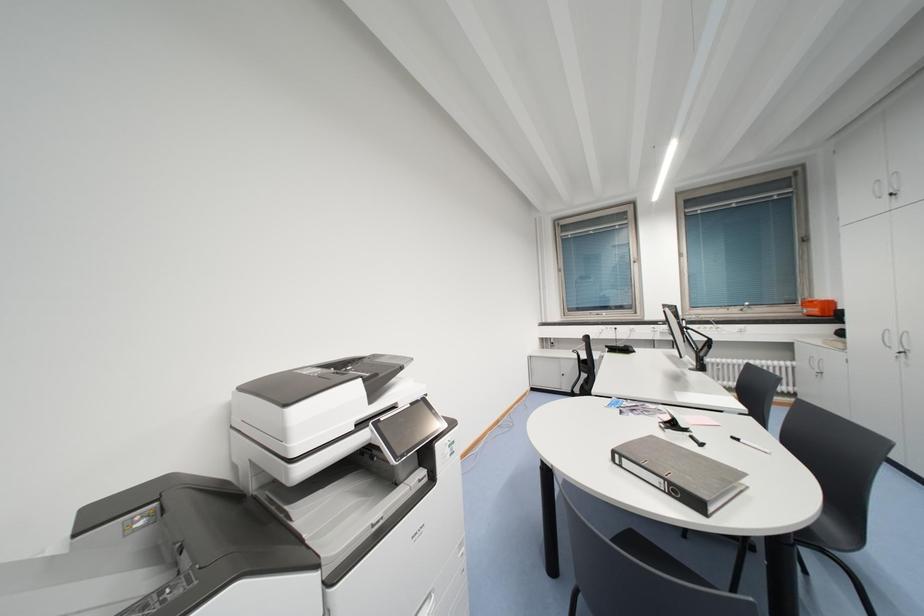
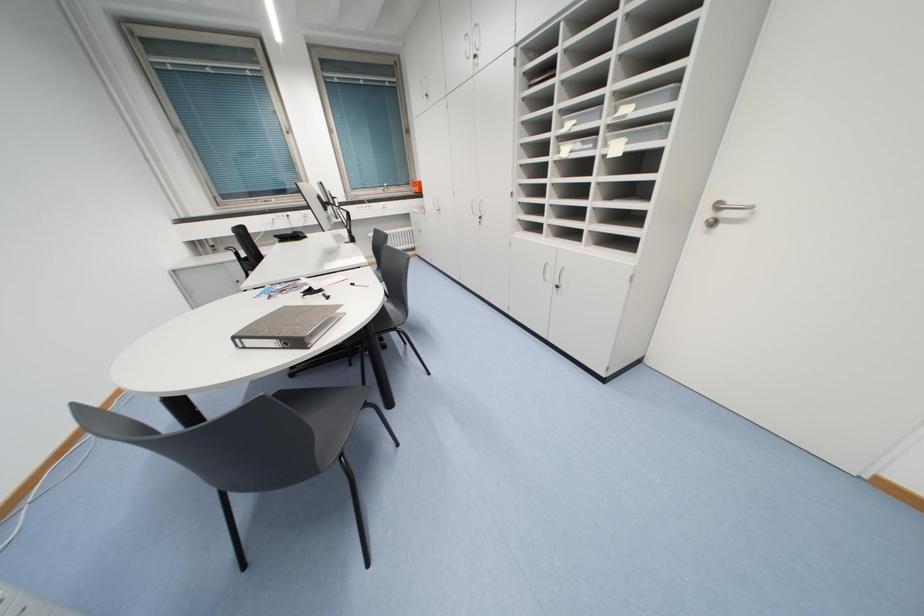
The first image is from the beginning of the video and the second image is from the end. How did the camera likely rotate when shooting the video?

The rotation direction of the camera is right-down.